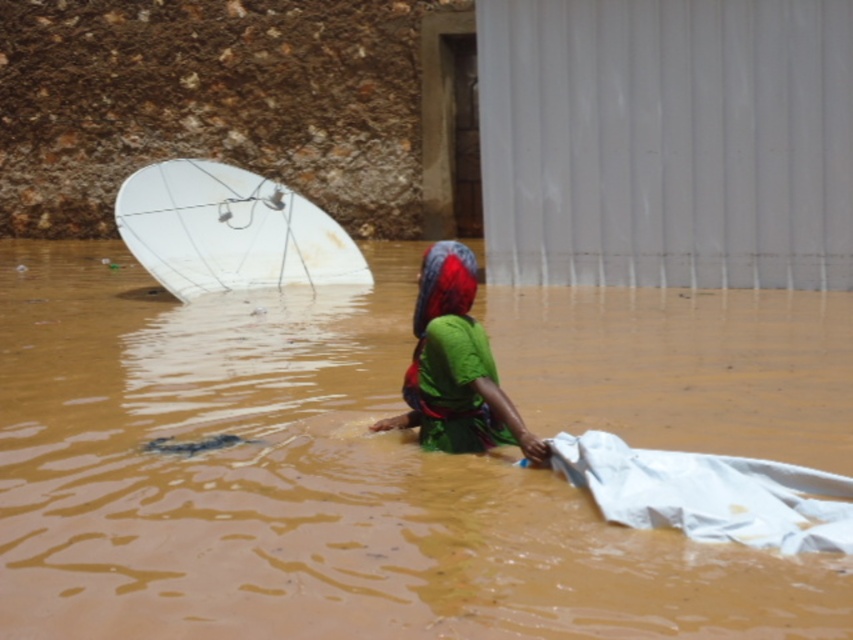
Question: Can you confirm if brown muddy water at center is thinner than green fabric at center?

Choices:
 (A) no
 (B) yes

Answer: (A)

Question: Which point appears farthest from the camera in this image?

Choices:
 (A) (447, 330)
 (B) (328, 216)
 (C) (805, 381)

Answer: (B)

Question: Which of the following is the closest to the observer?

Choices:
 (A) (647, 451)
 (B) (160, 221)
 (C) (436, 314)

Answer: (A)

Question: Can you confirm if white glossy satellite dish at upper left is bigger than white fabric at lower right?

Choices:
 (A) yes
 (B) no

Answer: (A)

Question: Can you confirm if brown muddy water at center is bigger than white glossy satellite dish at upper left?

Choices:
 (A) no
 (B) yes

Answer: (B)

Question: Based on their relative distances, which object is farther from the white fabric at lower right?

Choices:
 (A) green fabric at center
 (B) brown muddy water at center

Answer: (B)